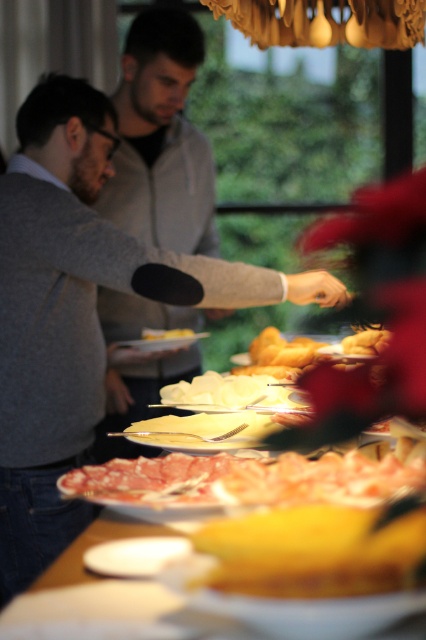
Question: Which of the following is the farthest from the observer?

Choices:
 (A) gray sweater at center
 (B) gray sweater at left
 (C) white matte plate at lower center
 (D) sliced pink meat at lower center

Answer: (A)

Question: Which of the following is the farthest from the observer?

Choices:
 (A) (267, 550)
 (B) (351, 348)
 (C) (65, 314)

Answer: (C)

Question: Which of the following is the closest to the observer?

Choices:
 (A) (198, 138)
 (B) (138, 560)

Answer: (B)

Question: Observing the image, what is the correct spatial positioning of white matte plate at lower center in reference to white matte plate at center?

Choices:
 (A) below
 (B) above

Answer: (A)

Question: Is gray sweater at center bigger than white matte plate at lower center?

Choices:
 (A) no
 (B) yes

Answer: (B)

Question: Is gray sweater at center positioned before yellow matte bread at center?

Choices:
 (A) no
 (B) yes

Answer: (A)